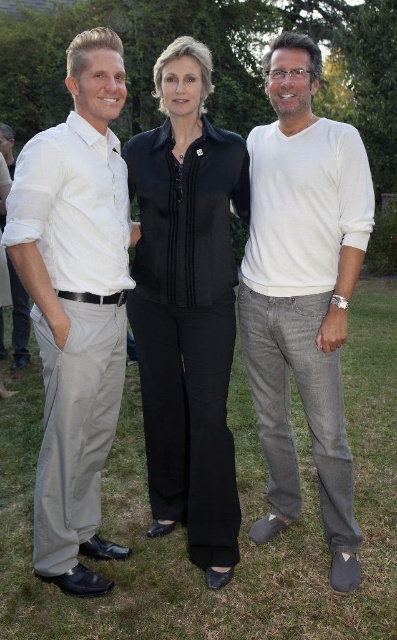
Question: Is black satin blouse at center to the left of white cotton sweater at center from the viewer's perspective?

Choices:
 (A) no
 (B) yes

Answer: (B)

Question: Which object is positioned closest to the white cotton sweater at center?

Choices:
 (A) black satin blouse at center
 (B) matte white shirt at left

Answer: (A)

Question: Which of these objects is positioned farthest from the white cotton sweater at center?

Choices:
 (A) matte white shirt at left
 (B) black satin blouse at center

Answer: (A)

Question: Is matte white shirt at left to the right of black satin blouse at center from the viewer's perspective?

Choices:
 (A) no
 (B) yes

Answer: (A)

Question: Can you confirm if matte white shirt at left is positioned below black satin blouse at center?

Choices:
 (A) yes
 (B) no

Answer: (A)

Question: Which object is the farthest from the black satin blouse at center?

Choices:
 (A) matte white shirt at left
 (B) white cotton sweater at center

Answer: (A)